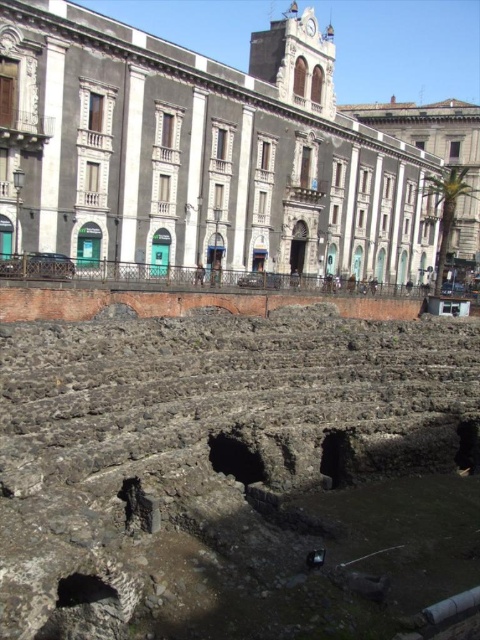
Question: Which object appears closest to the camera in this image?

Choices:
 (A) dusty stone ruins at lower center
 (B) white marble palace at upper center

Answer: (A)

Question: Is dark stone hole at center positioned at the back of dark stone hole at lower right?

Choices:
 (A) no
 (B) yes

Answer: (A)

Question: Which object is closer to the camera taking this photo?

Choices:
 (A) dark gray stone hole at lower left
 (B) dark gray stone building at center
 (C) dusty stone ruins at lower center

Answer: (C)

Question: Is dark stone arch at center positioned before dark gray stone hole at lower left?

Choices:
 (A) yes
 (B) no

Answer: (B)

Question: Which point is closer to the camera?

Choices:
 (A) (468, 433)
 (B) (419, 140)
 (C) (347, 454)
 (D) (106, 586)

Answer: (D)

Question: From the image, what is the correct spatial relationship of dark gray stone hole at lower left in relation to dark stone hole at lower right?

Choices:
 (A) above
 (B) below

Answer: (B)